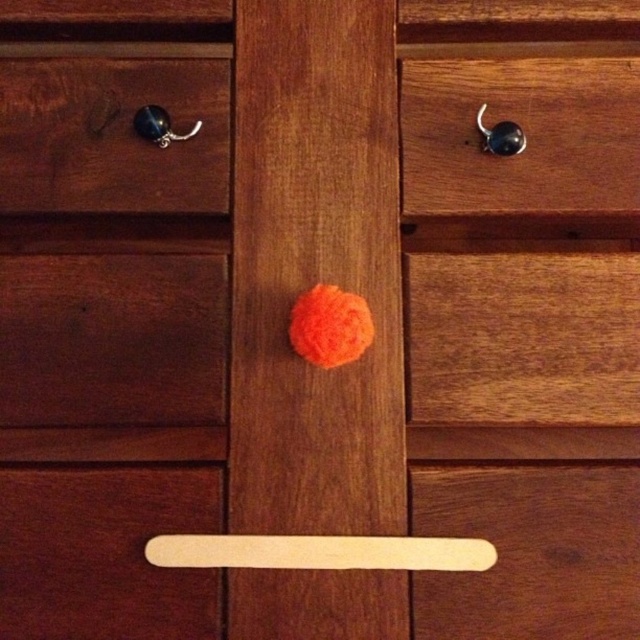
Who is positioned more to the right, wooden stick at lower left or metallic hook at upper right?

Positioned to the right is metallic hook at upper right.

Is point (138, 612) closer to camera compared to point (484, 106)?

That is True.

At what (x,y) coordinates should I click in order to perform the action: click on wooden stick at lower left. Please return your answer as a coordinate pair (x, y). Image resolution: width=640 pixels, height=640 pixels. Looking at the image, I should click on (104, 554).

Is wooden stick at lower center behind wooden stick at lower left?

No, it is in front of wooden stick at lower left.

This screenshot has height=640, width=640. Identify the location of wooden stick at lower center. (531, 552).

You are a GUI agent. You are given a task and a screenshot of the screen. Output one action in this format:
    pyautogui.click(x=<x>, y=<y>)
    Task: Click on the wooden stick at lower center
    
    Given the screenshot: What is the action you would take?
    pyautogui.click(x=531, y=552)

Who is higher up, wooden at center or wooden stick at lower center?

wooden at center is higher up.

Is wooden at center to the left of wooden stick at lower center from the viewer's perspective?

In fact, wooden at center is to the right of wooden stick at lower center.

Which is in front, point (532, 298) or point (452, 493)?

Point (452, 493)

This screenshot has width=640, height=640. Find the location of `wooden at center`. wooden at center is located at coordinates (522, 339).